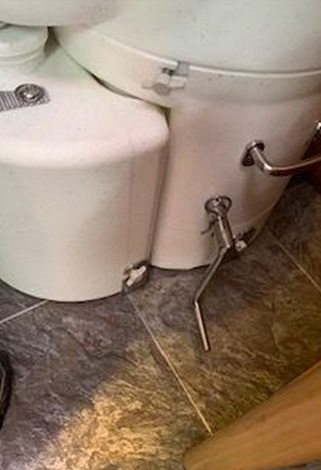
Where is `wall`? The image size is (321, 470). wall is located at coordinates pos(313,182).